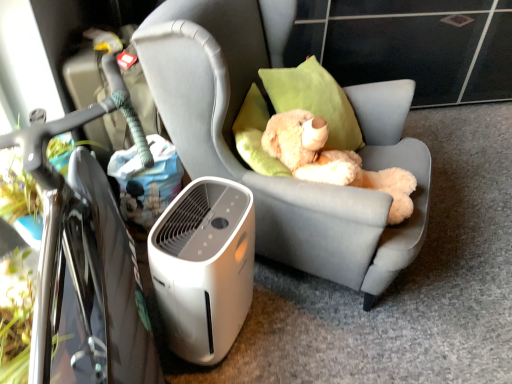
Locate an element on the screen. This screenshot has height=384, width=512. vacant space to the right of white plastic air purifier at lower left is located at coordinates (287, 329).